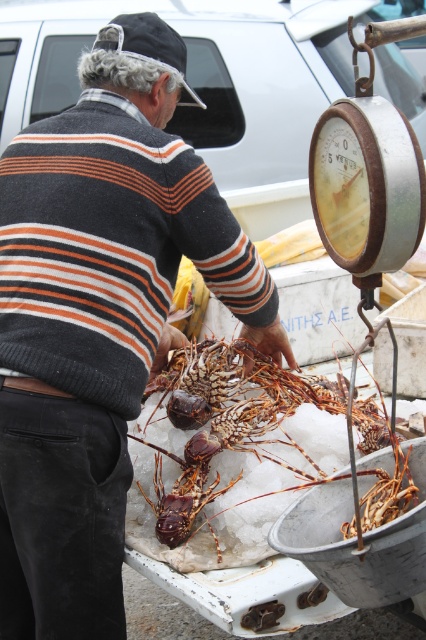
You are a photographer standing in front of the striped sweater at center. You want to take a closeup shot of the sweater without moving the subject. What is the minimum distance you should set your camera lens to focus on?

The striped sweater at center is 1.59 meters away from the camera. Therefore, the minimum focus distance should be set to at least 1.59 meters to capture the sweater clearly without moving the subject.

You are a customer at the seafood market and want to know which item is taller between the striped sweater at center and the shiny orange lobster at center. Can you tell me which one is taller?

The striped sweater at center is taller than the shiny orange lobster at center.

In the scene shown: You are standing in front of the striped sweater at center and the shiny orange lobster at center. Which object is nearer to you?

The striped sweater at center is closer to the viewer than the shiny orange lobster at center.